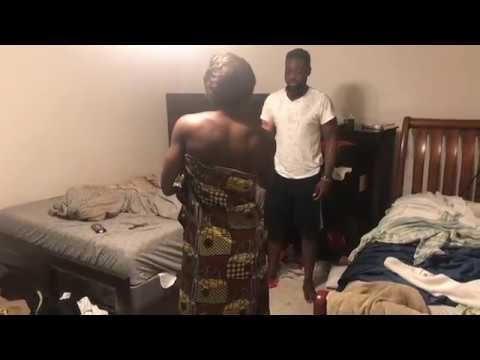
Find the location of a particular element. bed is located at coordinates (129, 245).